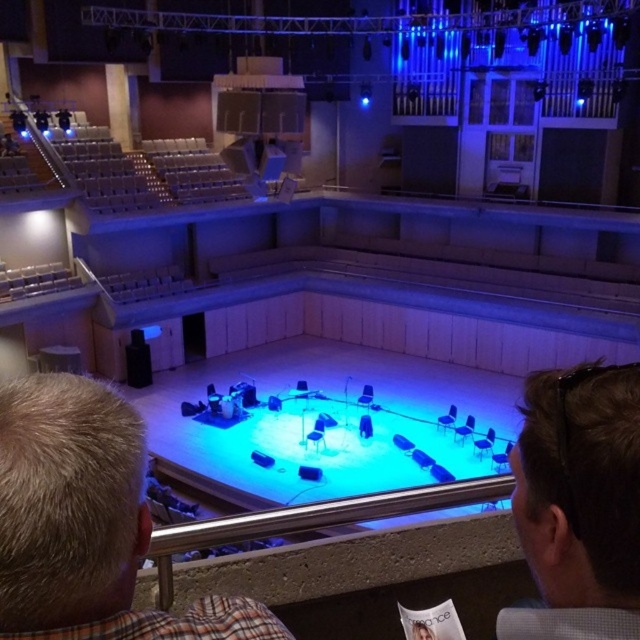
You are attending a concert in this venue and notice two performers on stage. One has blonde hair at center and the other has light brown hair at lower right. Which performer has shorter hair?

The blonde hair at center is smaller than the light brown hair at lower right, so the performer with blonde hair at center has shorter hair.

You are sitting in the front row of the theater and notice two performers on stage. One has blonde hair at center and the other has light brown hair at lower right. Which performer is closer to you?

The blonde hair at center is closer to you because it is in front of the light brown hair at lower right.

You are sitting in the elevated seating area of the concert hall and notice a person with blonde hair at center. Can you determine if this person is closer to the stage or the back wall based on their position?

The blonde hair at center is located at point 0.817 on the x and 0.136 on the y axis, which places them closer to the stage than the back wall.